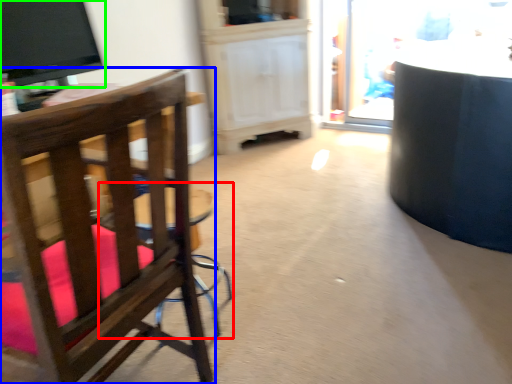
Question: Considering the real-world distances, which object is closest to bar stool (highlighted by a red box)? chair (highlighted by a blue box) or television (highlighted by a green box).

Choices:
 (A) chair
 (B) television

Answer: (A)